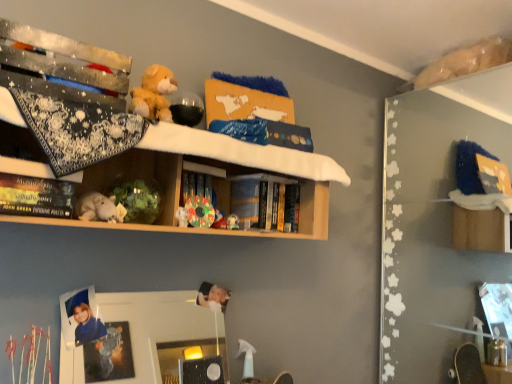
Question: Is white plush toy at center, the 1th toy viewed from the left, inside wooden shelf at upper center?

Choices:
 (A) yes
 (B) no

Answer: (A)

Question: Is the depth of wooden shelf at upper center less than that of white plush toy at center, the third toy from the right?

Choices:
 (A) yes
 (B) no

Answer: (A)

Question: Is wooden shelf at upper center bigger than white plush toy at center, the third toy from the right?

Choices:
 (A) yes
 (B) no

Answer: (A)

Question: Is wooden shelf at upper center outside of white plush toy at center, the 1th toy viewed from the left?

Choices:
 (A) yes
 (B) no

Answer: (A)

Question: From a real-world perspective, is wooden shelf at upper center on top of white plush toy at center, the 1th toy viewed from the left?

Choices:
 (A) yes
 (B) no

Answer: (A)

Question: Is wooden shelf at upper center not close to white plush toy at center, the 1th toy viewed from the left?

Choices:
 (A) yes
 (B) no

Answer: (B)

Question: From the image's perspective, is white plush toy at center, the 1th toy viewed from the left, located above translucent plastic toy at center, which is the 2th toy from left to right?

Choices:
 (A) no
 (B) yes

Answer: (B)

Question: Is white plush toy at center, the third toy from the right, outside translucent plastic toy at center, the second toy in the right-to-left sequence?

Choices:
 (A) yes
 (B) no

Answer: (A)

Question: Does white plush toy at center, the first toy from the front, have a larger size compared to translucent plastic toy at center, the 2th toy when ordered from front to back?

Choices:
 (A) yes
 (B) no

Answer: (A)

Question: From a real-world perspective, is white plush toy at center, the 1th toy viewed from the left, physically above translucent plastic toy at center, the 2th toy when ordered from front to back?

Choices:
 (A) no
 (B) yes

Answer: (B)

Question: Is white plush toy at center, which is the third toy from back to front, facing away from translucent plastic toy at center, acting as the second toy starting from the back?

Choices:
 (A) no
 (B) yes

Answer: (A)

Question: Is white plush toy at center, the third toy from the right, at the right side of translucent plastic toy at center, which is the 2th toy from left to right?

Choices:
 (A) no
 (B) yes

Answer: (A)

Question: Is clear glass mirror at center behind multicolored plastic toy at center, the third toy when ordered from front to back?

Choices:
 (A) yes
 (B) no

Answer: (B)